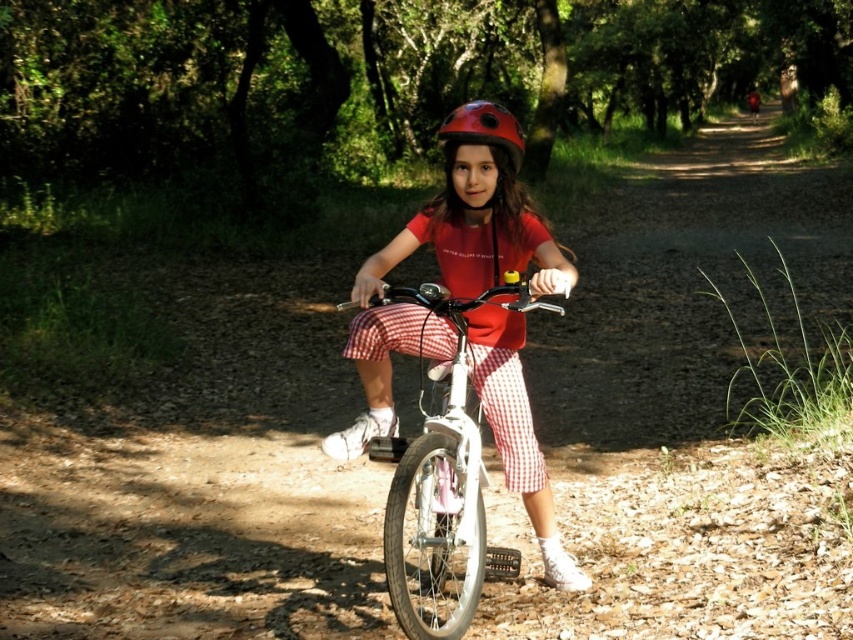
The girl is trying to fit her shiny red helmet at center into a small backpack compartment. The compartment can only accommodate items narrower than the white matte bicycle at center. Will the helmet fit?

The white matte bicycle at center is wider than the shiny red helmet at center, so the helmet is narrower than the bicycle. Since the compartment can hold items narrower than the bicycle, the helmet will fit.

The girl is trying to decide whether her shiny red helmet at center will fit inside the basket of her white matte bicycle at center. Based on their sizes, can you help her determine if the helmet will fit?

The white matte bicycle at center is not as tall as the shiny red helmet at center, so the helmet is taller than the bicycle basket. Therefore, the shiny red helmet at center will not fit inside the basket of the white matte bicycle at center.

You are designing a storage area for the items in the image. The storage area has a limited space. Which item, the white matte bicycle at center or the shiny red helmet at center, should be stored first to optimize space?

The white matte bicycle at center occupies less space than the shiny red helmet at center, so it should be stored first to free up more space for the larger helmet.